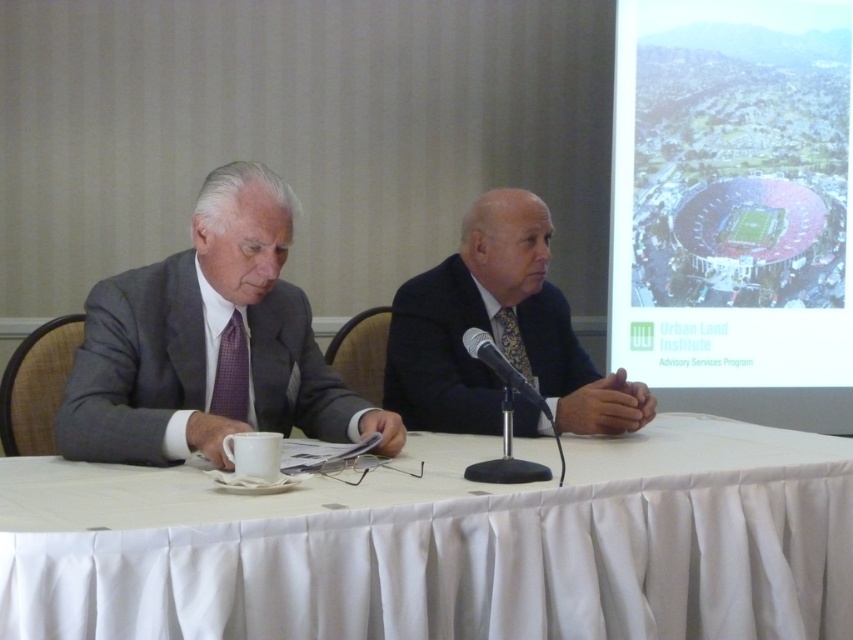
You are organizing a charity event and need to decide which item to place first in a donation box. The items are the gray textured suit at left and the patterned silk tie at center. Based on their sizes, which should be placed first?

The gray textured suit at left is larger than the patterned silk tie at center, so it should be placed first in the donation box to accommodate its size.

You are a fashion designer observing a meeting between two men. You notice the gray textured suit at left and the patterned silk tie at center. Which clothing item is positioned higher in the image?

The gray textured suit at left is located above the patterned silk tie at center, so it is positioned higher in the image.

You are a photographer positioned behind the two men at the table. You need to take a photo where both the dark blue suit at center and the patterned silk tie at center are clearly visible. Considering their positions, which object will appear larger in the photo?

The dark blue suit at center will appear larger in the photo because it is closer to the viewer than the patterned silk tie at center.